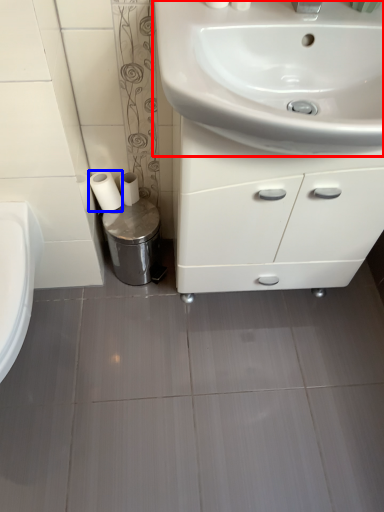
Question: Which object appears farthest to the camera in this image, sink (highlighted by a red box) or toilet paper (highlighted by a blue box)?

Choices:
 (A) sink
 (B) toilet paper

Answer: (B)